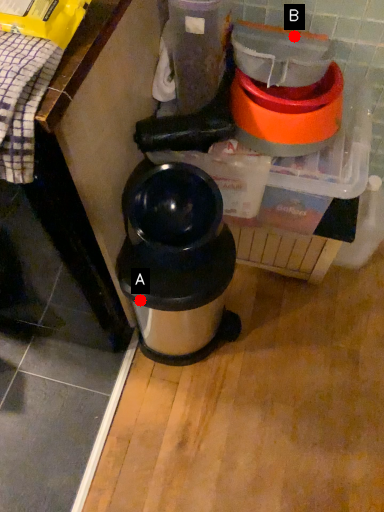
Question: Two points are circled on the image, labeled by A and B beside each circle. Which point is closer to the camera taking this photo?

Choices:
 (A) A is closer
 (B) B is closer

Answer: (A)